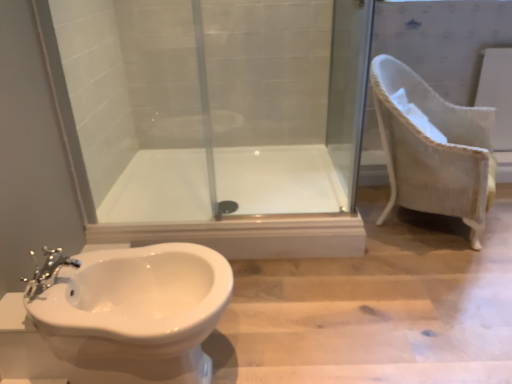
The image size is (512, 384). I want to click on free space in front of white woven armchair at right, so click(x=431, y=283).